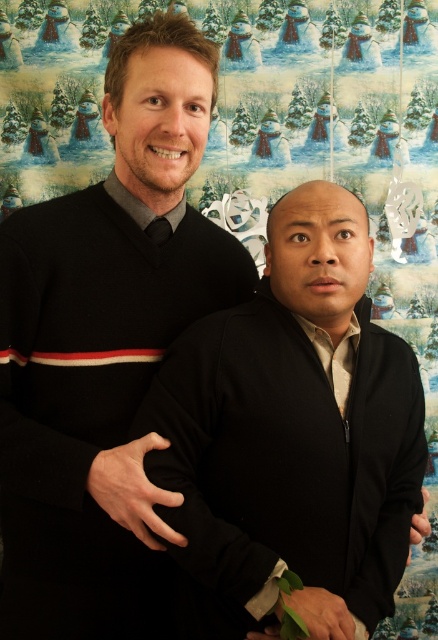
You are a photographer trying to capture both the black matte sweater at left and the black matte sweater at center in a single shot. Which sweater should you focus on first to ensure both are in focus?

You should focus on the black matte sweater at left first because it is closer to you than the black matte sweater at center, ensuring both will be in focus when using depth of field properly.

Looking at this image, you are organizing a clothing store and need to arrange the black matte sweater at left and the black matte sweater at center on a rack. Which sweater should you place on the left side of the rack to ensure they are arranged from thinnest to thickest?

The black matte sweater at left is thinner than the black matte sweater at center, so you should place the black matte sweater at left on the left side of the rack to arrange them from thinnest to thickest.

You are organizing a clothing store and need to arrange the black matte sweater at left and the black matte sweater at center based on their sizes. Which one should be placed in the large section?

The black matte sweater at left should be placed in the large section because it has a larger size compared to the black matte sweater at center.